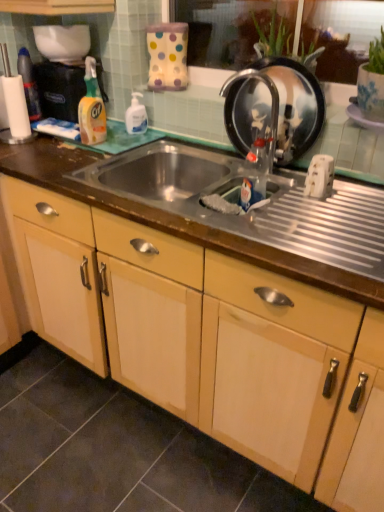
Describe the element at coordinates (167, 56) in the screenshot. I see `polka dot fabric bag at upper center, marked as the 2th appliance in a right-to-left arrangement` at that location.

What is the approximate width of polka dot fabric bag at upper center, the 1th appliance positioned from the left?

polka dot fabric bag at upper center, the 1th appliance positioned from the left, is 6.69 inches in width.

What is the approximate height of translucent plastic bottle at center, which is counted as the 2th bottle, starting from the left?

The height of translucent plastic bottle at center, which is counted as the 2th bottle, starting from the left, is 8.80 inches.

Locate an element on the screen. Image resolution: width=384 pixels, height=512 pixels. stainless steel sink at center is located at coordinates (226, 215).

Locate an element on the screen. This screenshot has height=512, width=384. yellow plastic spray bottle at left, the 2th cleaning product positioned from the right is located at coordinates (92, 108).

This screenshot has width=384, height=512. Describe the element at coordinates (271, 98) in the screenshot. I see `silver metallic faucet at upper center` at that location.

The image size is (384, 512). Describe the element at coordinates (211, 334) in the screenshot. I see `wooden cabinet at center` at that location.

Describe the element at coordinates (29, 84) in the screenshot. I see `translucent plastic bottle at upper left, arranged as the 2th bottle when viewed from the right` at that location.

How much space does translucent plastic bottle at upper left, which is the first bottle from top to bottom, occupy vertically?

translucent plastic bottle at upper left, which is the first bottle from top to bottom, is 10.49 inches in height.

Locate an element on the screen. The height and width of the screenshot is (512, 384). metallic silver frying pan at upper right, placed as the second appliance when sorted from top to bottom is located at coordinates (274, 106).

The width and height of the screenshot is (384, 512). Identify the location of the 1st appliance above the white glossy pump bottle at upper center, which is the 1th cleaning product from right to left (from a real-world perspective). tap(274, 106).

Based on the photo, from the image's perspective, between metallic silver frying pan at upper right, positioned as the 1th appliance in right-to-left order, and white glossy pump bottle at upper center, which is the 1th cleaning product from right to left, who is located below?

A: From the image's view, metallic silver frying pan at upper right, positioned as the 1th appliance in right-to-left order, is below.

Is metallic silver frying pan at upper right, positioned as the 1th appliance in right-to-left order, thinner than white glossy pump bottle at upper center, the second cleaning product viewed from the left?

Yes, metallic silver frying pan at upper right, positioned as the 1th appliance in right-to-left order, is thinner than white glossy pump bottle at upper center, the second cleaning product viewed from the left.

Is translucent plastic bottle at upper left, which is the first bottle from top to bottom, not within white glossy pump bottle at upper center, the second cleaning product viewed from the left?

Yes, translucent plastic bottle at upper left, which is the first bottle from top to bottom, is located beyond the bounds of white glossy pump bottle at upper center, the second cleaning product viewed from the left.

Is point (33, 113) positioned after point (127, 119)?

Yes, point (33, 113) is farther from viewer.

From the image's perspective, which one is positioned higher, translucent plastic bottle at upper left, arranged as the 2th bottle when viewed from the right, or white glossy pump bottle at upper center, which is the 1th cleaning product from right to left?

translucent plastic bottle at upper left, arranged as the 2th bottle when viewed from the right, from the image's perspective.

In the scene shown: From a real-world perspective, is translucent plastic bottle at upper left, acting as the 2th bottle starting from the bottom, above or below white glossy pump bottle at upper center, the second cleaning product viewed from the left?

Clearly, from a real-world perspective, translucent plastic bottle at upper left, acting as the 2th bottle starting from the bottom, is above white glossy pump bottle at upper center, the second cleaning product viewed from the left.

Locate an element on the screen. Image resolution: width=384 pixels, height=512 pixels. appliance on the right of stainless steel sink at center is located at coordinates (274, 106).

Would you say stainless steel sink at center is a long distance from metallic silver frying pan at upper right, positioned as the first appliance in bottom-to-top order?

stainless steel sink at center is near metallic silver frying pan at upper right, positioned as the first appliance in bottom-to-top order, not far away.

Who is smaller, stainless steel sink at center or metallic silver frying pan at upper right, placed as the second appliance when sorted from top to bottom?

metallic silver frying pan at upper right, placed as the second appliance when sorted from top to bottom, is smaller.

Is stainless steel sink at center shorter than metallic silver frying pan at upper right, placed as the 2th appliance when sorted from left to right?

Yes, stainless steel sink at center is shorter than metallic silver frying pan at upper right, placed as the 2th appliance when sorted from left to right.

Can you tell me how much translucent plastic bottle at upper left, which appears as the 1th bottle when viewed from the back, and metallic silver frying pan at upper right, placed as the 2th appliance when sorted from left to right, differ in facing direction?

7.7 degrees separate the facing orientations of translucent plastic bottle at upper left, which appears as the 1th bottle when viewed from the back, and metallic silver frying pan at upper right, placed as the 2th appliance when sorted from left to right.

Is translucent plastic bottle at upper left, which appears as the 2th bottle when viewed from the front, facing towards metallic silver frying pan at upper right, placed as the 2th appliance when sorted from left to right?

No.

Is translucent plastic bottle at upper left, which appears as the 2th bottle when viewed from the front, with metallic silver frying pan at upper right, placed as the second appliance when sorted from top to bottom?

No, translucent plastic bottle at upper left, which appears as the 2th bottle when viewed from the front, is not touching metallic silver frying pan at upper right, placed as the second appliance when sorted from top to bottom.

Image resolution: width=384 pixels, height=512 pixels. I want to click on bottle above the metallic silver frying pan at upper right, positioned as the 1th appliance in right-to-left order (from a real-world perspective), so click(29, 84).

Considering the relative sizes of translucent plastic bottle at center, acting as the first bottle starting from the bottom, and wooden cabinet at center in the image provided, is translucent plastic bottle at center, acting as the first bottle starting from the bottom, wider than wooden cabinet at center?

No.

From the image's perspective, would you say translucent plastic bottle at center, arranged as the 1th bottle when viewed from the right, is positioned over wooden cabinet at center?

Yes.

Considering the positions of point (256, 184) and point (259, 324), is point (256, 184) closer or farther from the camera than point (259, 324)?

Point (256, 184) is farther from the camera than point (259, 324).

Looking at this image, which object is closer to the camera, silver metallic faucet at upper center or stainless steel sink at center?

stainless steel sink at center is closer to the camera.

Is silver metallic faucet at upper center bigger or smaller than stainless steel sink at center?

silver metallic faucet at upper center is smaller than stainless steel sink at center.

Considering the relative sizes of silver metallic faucet at upper center and stainless steel sink at center in the image provided, is silver metallic faucet at upper center wider than stainless steel sink at center?

No, silver metallic faucet at upper center is not wider than stainless steel sink at center.

Which of these two, silver metallic faucet at upper center or stainless steel sink at center, stands shorter?

stainless steel sink at center.

Is point (89, 141) less distant than point (166, 79)?

Yes, it is in front of point (166, 79).

Is yellow plastic spray bottle at left, acting as the first cleaning product starting from the left, positioned before polka dot fabric bag at upper center, marked as the 2th appliance in a right-to-left arrangement?

That is True.

From the picture: Does yellow plastic spray bottle at left, the 2th cleaning product positioned from the right, have a larger size compared to polka dot fabric bag at upper center, marked as the 2th appliance in a right-to-left arrangement?

No, yellow plastic spray bottle at left, the 2th cleaning product positioned from the right, is not bigger than polka dot fabric bag at upper center, marked as the 2th appliance in a right-to-left arrangement.

I want to click on the 1st appliance directly above the white glossy pump bottle at upper center, the second cleaning product viewed from the left (from a real-world perspective), so click(274, 106).

Find the location of a particular element. This screenshot has width=384, height=512. the 2nd cleaning product directly beneath the translucent plastic bottle at upper left, which appears as the 1th bottle when viewed from the back (from a real-world perspective) is located at coordinates (136, 116).

Which object lies nearer to the anchor point wooden cabinet at center, metallic silver frying pan at upper right, placed as the second appliance when sorted from top to bottom, or yellow plastic spray bottle at left, acting as the first cleaning product starting from the left?

Among the two, metallic silver frying pan at upper right, placed as the second appliance when sorted from top to bottom, is located nearer to wooden cabinet at center.

From the image, which object appears to be farther from wooden cabinet at center, translucent plastic bottle at center, which ranks as the 2th bottle in back-to-front order, or stainless steel sink at center?

translucent plastic bottle at center, which ranks as the 2th bottle in back-to-front order, is further to wooden cabinet at center.

Based on their spatial positions, is white glossy pump bottle at upper center, the second cleaning product viewed from the left, or translucent plastic bottle at upper left, acting as the 2th bottle starting from the bottom, further from silver metallic faucet at upper center?

translucent plastic bottle at upper left, acting as the 2th bottle starting from the bottom, lies further to silver metallic faucet at upper center than the other object.

Estimate the real-world distances between objects in this image. Which object is closer to translucent plastic bottle at upper left, arranged as the 2th bottle when viewed from the right, white glossy pump bottle at upper center, the second cleaning product viewed from the left, or silver metallic faucet at upper center?

Based on the image, white glossy pump bottle at upper center, the second cleaning product viewed from the left, appears to be nearer to translucent plastic bottle at upper left, arranged as the 2th bottle when viewed from the right.

Considering their positions, is wooden cabinet at center positioned further to silver metallic faucet at upper center than translucent plastic bottle at center, acting as the first bottle starting from the bottom?

wooden cabinet at center is further to silver metallic faucet at upper center.

From the image, which object appears to be farther from metallic silver frying pan at upper right, positioned as the first appliance in bottom-to-top order, stainless steel sink at center or translucent plastic bottle at center, arranged as the 1th bottle when viewed from the front?

stainless steel sink at center is positioned further to the anchor metallic silver frying pan at upper right, positioned as the first appliance in bottom-to-top order.

Considering their positions, is white glossy pump bottle at upper center, the second cleaning product viewed from the left, positioned further to stainless steel sink at center than silver metallic faucet at upper center?

white glossy pump bottle at upper center, the second cleaning product viewed from the left.

Estimate the real-world distances between objects in this image. Which object is closer to yellow plastic spray bottle at left, acting as the first cleaning product starting from the left, wooden cabinet at center or white glossy pump bottle at upper center, the second cleaning product viewed from the left?

white glossy pump bottle at upper center, the second cleaning product viewed from the left.

Locate an element on the screen. The width and height of the screenshot is (384, 512). cleaning product located between translucent plastic bottle at upper left, which is the first bottle from top to bottom, and white glossy pump bottle at upper center, the second cleaning product viewed from the left, in the left-right direction is located at coordinates (92, 108).

Where is `faucet that lies between polka dot fabric bag at upper center, the second appliance from the bottom, and translucent plastic bottle at center, which is the 2th bottle in top-to-bottom order, from top to bottom`? The height and width of the screenshot is (512, 384). faucet that lies between polka dot fabric bag at upper center, the second appliance from the bottom, and translucent plastic bottle at center, which is the 2th bottle in top-to-bottom order, from top to bottom is located at coordinates (271, 98).

Locate an element on the screen. appliance between polka dot fabric bag at upper center, marked as the 2th appliance in a right-to-left arrangement, and wooden cabinet at center from top to bottom is located at coordinates (274, 106).

Image resolution: width=384 pixels, height=512 pixels. I want to click on faucet that lies between polka dot fabric bag at upper center, acting as the 1th appliance starting from the top, and wooden cabinet at center from top to bottom, so click(x=271, y=98).